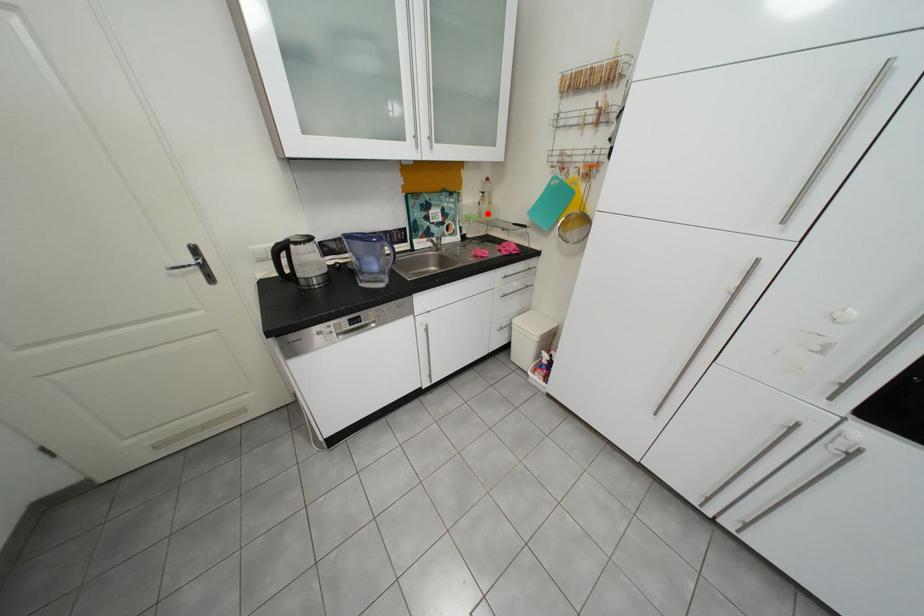
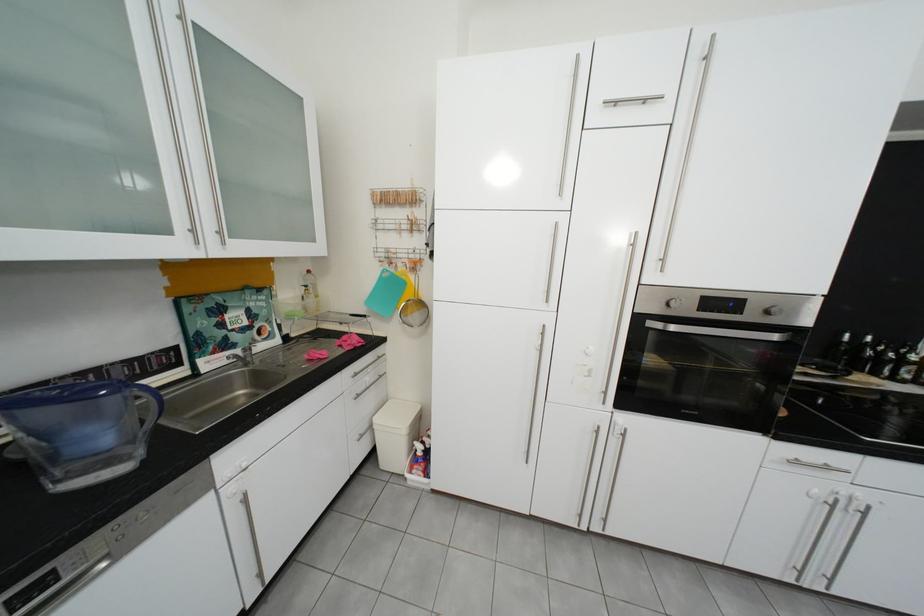
Where in the second image is the point corresponding to the highlighted location from the first image?

(311, 310)